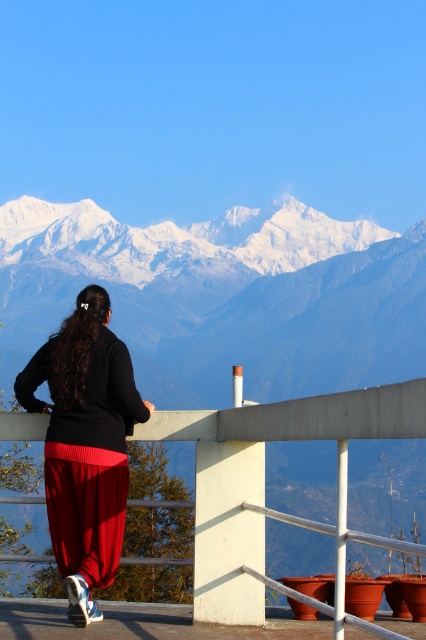
Describe the element at coordinates (264, 483) in the screenshot. I see `concrete at center` at that location.

Who is taller, concrete at center or matte black sweater at center?

matte black sweater at center is taller.

At what (x,y) coordinates should I click in order to perform the action: click on concrete at center. Please return your answer as a coordinate pair (x, y). Looking at the image, I should click on (264, 483).

I want to click on concrete at center, so click(x=264, y=483).